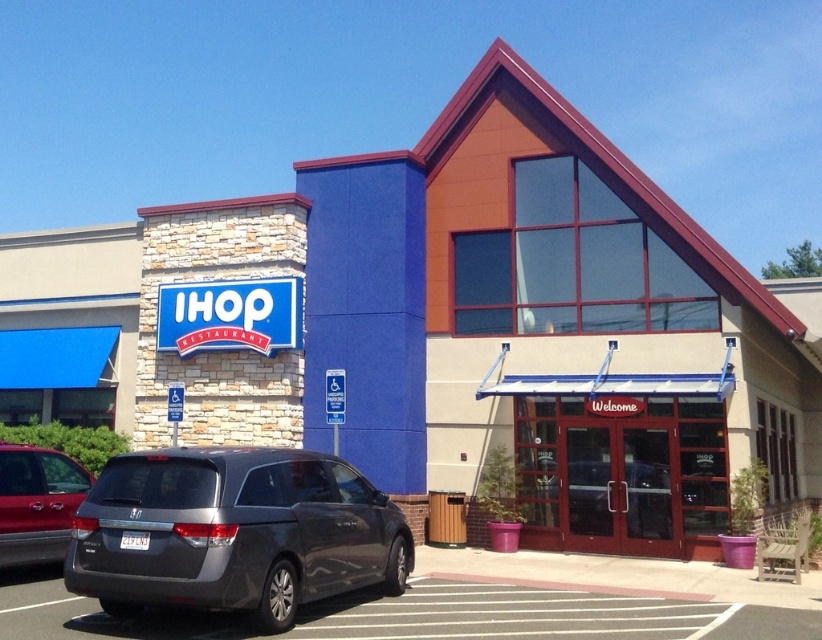
Question: Which point appears closest to the camera in this image?

Choices:
 (A) (167, 515)
 (B) (12, 513)

Answer: (A)

Question: Which of the following is the farthest from the observer?

Choices:
 (A) (68, 492)
 (B) (169, 504)

Answer: (A)

Question: Can you confirm if satin gray minivan at lower left is smaller than gray asphalt parking lot at lower left?

Choices:
 (A) no
 (B) yes

Answer: (B)

Question: Can you confirm if satin gray minivan at lower left is smaller than gray asphalt parking lot at lower left?

Choices:
 (A) no
 (B) yes

Answer: (B)

Question: Which is farther from the satin gray minivan at lower left?

Choices:
 (A) gray asphalt parking lot at lower left
 (B) metallic silver minivan at left

Answer: (B)

Question: From the image, what is the correct spatial relationship of gray asphalt parking lot at lower left in relation to metallic silver minivan at left?

Choices:
 (A) right
 (B) left

Answer: (A)